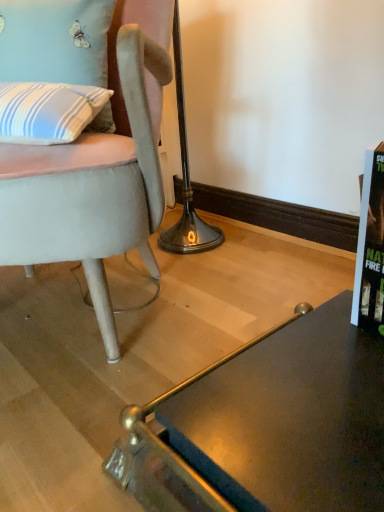
Question: Is suede-like gray chair at left not close to glassy dark brown desk at lower right?

Choices:
 (A) yes
 (B) no

Answer: (B)

Question: From the image's perspective, does suede-like gray chair at left appear lower than glassy dark brown desk at lower right?

Choices:
 (A) no
 (B) yes

Answer: (A)

Question: Could glassy dark brown desk at lower right be considered to be inside suede-like gray chair at left?

Choices:
 (A) no
 (B) yes

Answer: (A)

Question: Considering the relative positions of suede-like gray chair at left and glassy dark brown desk at lower right in the image provided, is suede-like gray chair at left behind glassy dark brown desk at lower right?

Choices:
 (A) no
 (B) yes

Answer: (B)

Question: Can you see suede-like gray chair at left touching glassy dark brown desk at lower right?

Choices:
 (A) no
 (B) yes

Answer: (A)

Question: Is point (92, 232) positioned closer to the camera than point (324, 313)?

Choices:
 (A) farther
 (B) closer

Answer: (B)

Question: From the image's perspective, is suede-like gray chair at left positioned above or below glassy dark brown desk at lower right?

Choices:
 (A) above
 (B) below

Answer: (A)

Question: From a real-world perspective, relative to glassy dark brown desk at lower right, is suede-like gray chair at left vertically above or below?

Choices:
 (A) below
 (B) above

Answer: (B)

Question: Considering the relative positions of suede-like gray chair at left and glassy dark brown desk at lower right in the image provided, is suede-like gray chair at left to the left or to the right of glassy dark brown desk at lower right?

Choices:
 (A) right
 (B) left

Answer: (B)

Question: Looking at their shapes, would you say suede-like gray chair at left is wider or thinner than blue striped fabric pillow at upper left?

Choices:
 (A) wide
 (B) thin

Answer: (A)

Question: Is suede-like gray chair at left inside or outside of blue striped fabric pillow at upper left?

Choices:
 (A) inside
 (B) outside

Answer: (B)

Question: From the image's perspective, is suede-like gray chair at left above or below blue striped fabric pillow at upper left?

Choices:
 (A) below
 (B) above

Answer: (A)

Question: Considering the positions of suede-like gray chair at left and blue striped fabric pillow at upper left in the image, is suede-like gray chair at left bigger or smaller than blue striped fabric pillow at upper left?

Choices:
 (A) big
 (B) small

Answer: (A)

Question: Which is correct: blue striped fabric pillow at upper left is inside glassy dark brown desk at lower right, or outside of it?

Choices:
 (A) inside
 (B) outside

Answer: (B)

Question: Does point (49, 5) appear closer or farther from the camera than point (309, 463)?

Choices:
 (A) farther
 (B) closer

Answer: (A)